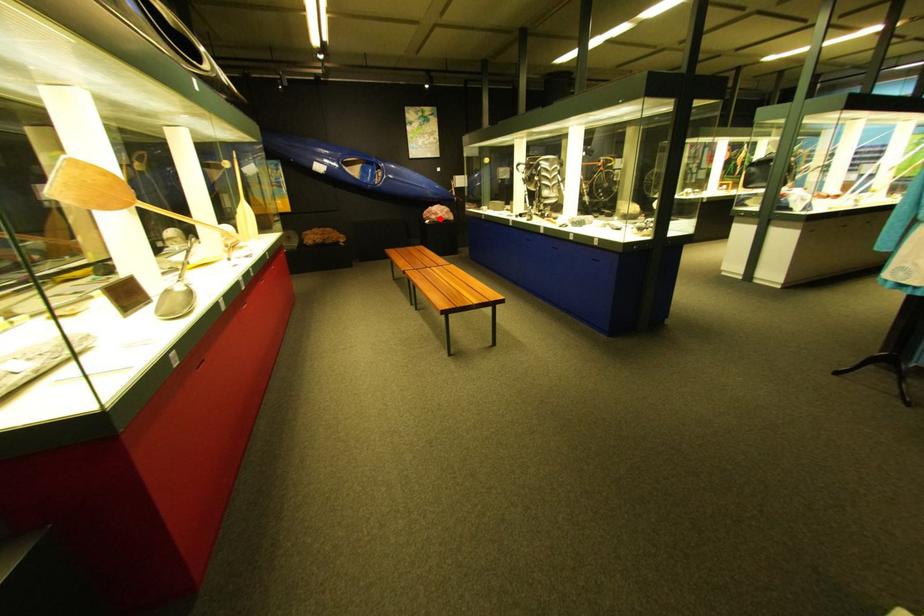
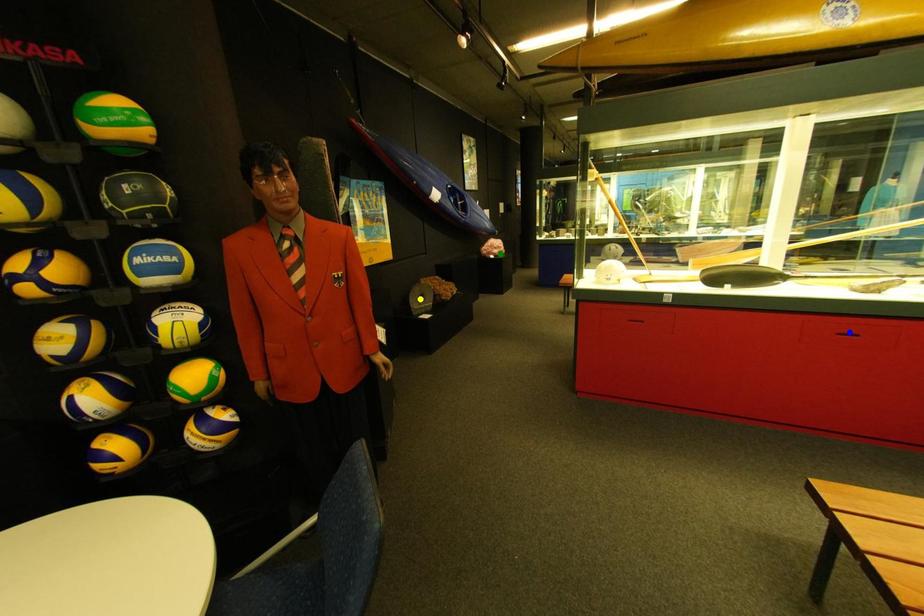
Question: I am providing you with two images of the same scene from different viewpoints. A red point is marked on the first image. You are given multiple points on the second image. Which mark in image 2 goes with the point in image 1?

Choices:
 (A) green point
 (B) yellow point
 (C) blue point

Answer: (A)